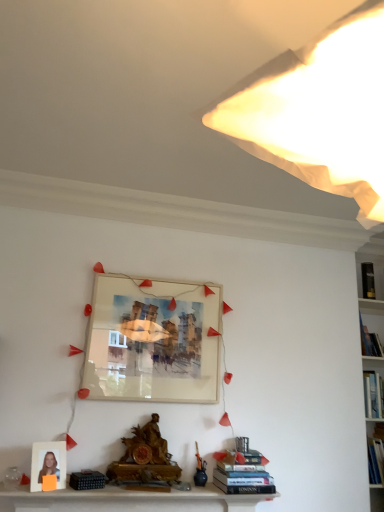
This screenshot has width=384, height=512. I want to click on free space above matte glass picture frame at center, which is the second picture frame from bottom to top (from a real-world perspective), so click(165, 280).